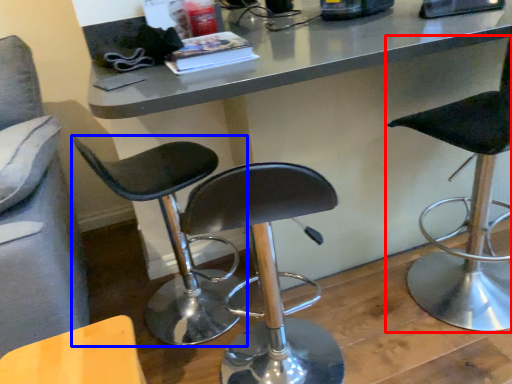
Question: Which object is further to the camera taking this photo, chair (highlighted by a red box) or chair (highlighted by a blue box)?

Choices:
 (A) chair
 (B) chair

Answer: (B)